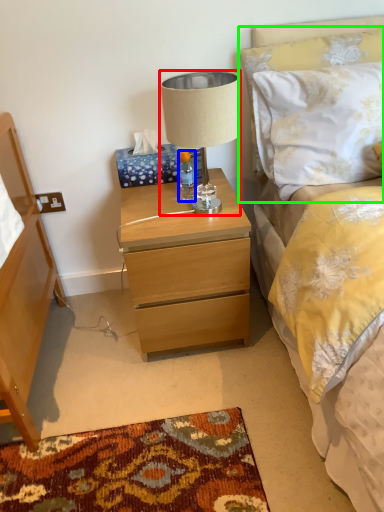
Question: Which object is the farthest from lamp (highlighted by a red box)? Choose among these: bottle (highlighted by a blue box) or pillow (highlighted by a green box).

Choices:
 (A) bottle
 (B) pillow

Answer: (A)